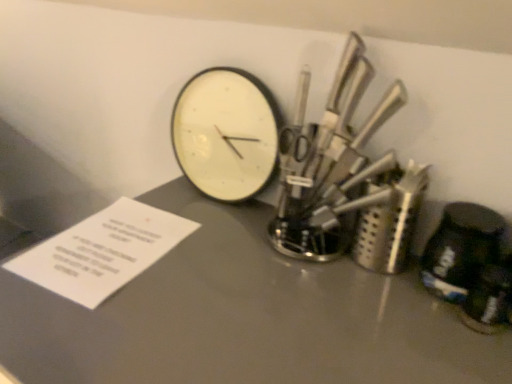
Locate an element on the screen. vacant space in between polished metal knife set at upper right and white paper at lower left is located at coordinates (224, 262).